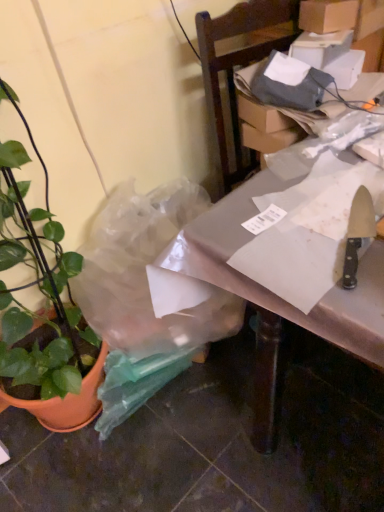
You are a GUI agent. You are given a task and a screenshot of the screen. Output one action in this format:
    pyautogui.click(x=<x>, y=<y>)
    Task: Click on the free space above metallic silver table at center (from a real-world perspective)
    Image resolution: width=384 pixels, height=512 pixels.
    Given the screenshot: What is the action you would take?
    pyautogui.click(x=316, y=195)